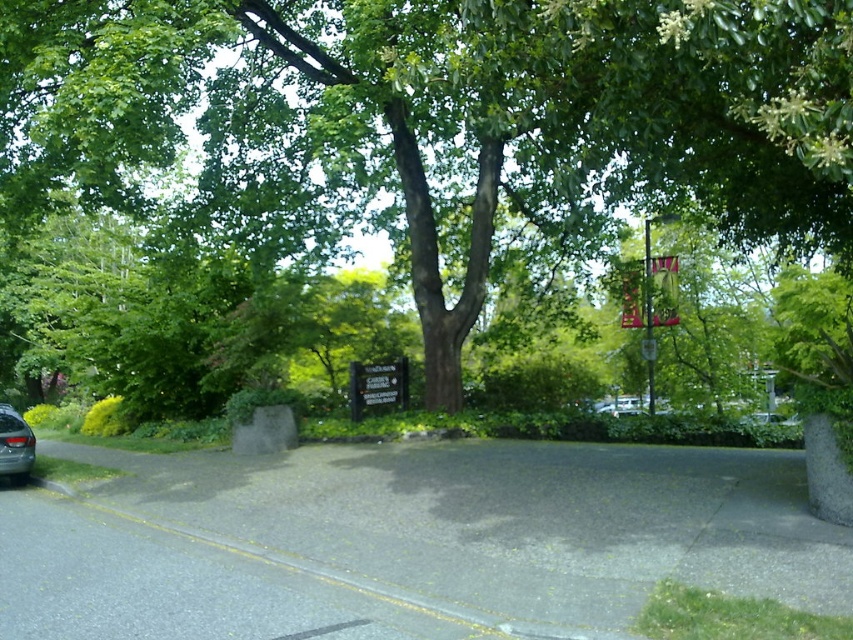
You are standing at the edge of the paved area marked by the yellow line. You see a green leafy tree at center represented by point (439, 118). If you walk straight ahead from your current position, will you reach the tree before the pavement ends?

The green leafy tree at center represented by point (439, 118) is located in the middle ground of the scene. Since the pavement extends from the foreground to the middle ground where the tree is situated, walking straight ahead from the yellow line edge would lead you toward the tree before the pavement ends.

You are a delivery person needing to park your 4.5 meter long truck between the green leafy tree at center and the silver metallic car at lower left. Can you fit your truck in that space without touching either?

The distance between the green leafy tree at center and the silver metallic car at lower left is 8.16 meters. Since your truck is 4.5 meters long, there is enough space to park without touching either object.